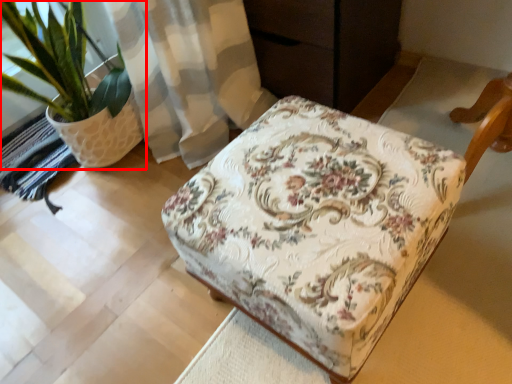
Question: From the image's perspective, what is the correct spatial positioning of houseplant (annotated by the red box) in reference to furniture?

Choices:
 (A) below
 (B) above

Answer: (B)